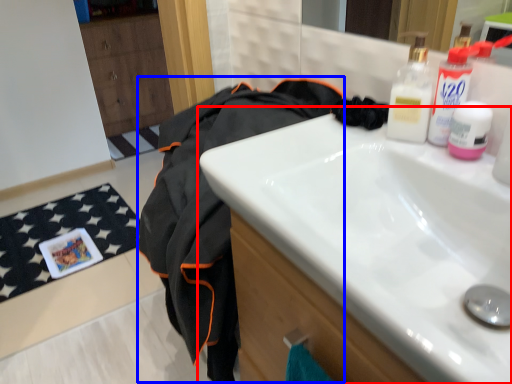
Question: Which object appears farthest to the camera in this image, sink (highlighted by a red box) or clothing (highlighted by a blue box)?

Choices:
 (A) sink
 (B) clothing

Answer: (B)